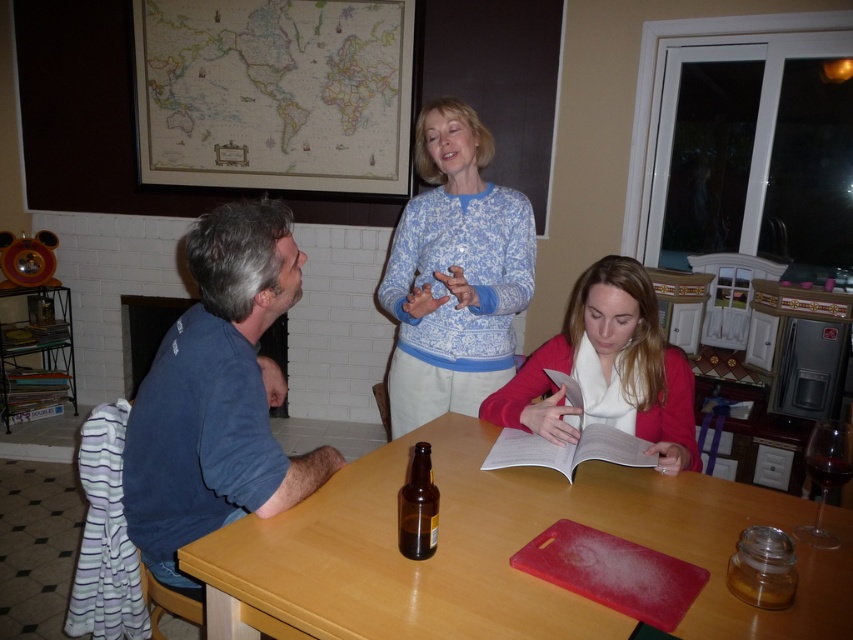
Question: Which point is farther to the camera?

Choices:
 (A) blue cotton shirt at left
 (B) blue patterned sweater at center
 (C) brown glass bottle at center

Answer: (B)

Question: Does vintage paper map at upper center lie behind blue patterned sweater at center?

Choices:
 (A) no
 (B) yes

Answer: (B)

Question: Considering the real-world distances, which object is farthest from the blue patterned sweater at center?

Choices:
 (A) blue cotton shirt at left
 (B) matte pink sweater at lower center
 (C) vintage paper map at upper center

Answer: (C)

Question: Can you confirm if blue cotton shirt at left is smaller than matte pink sweater at lower center?

Choices:
 (A) yes
 (B) no

Answer: (B)

Question: Which object is farther from the camera taking this photo?

Choices:
 (A) wooden table at center
 (B) matte pink sweater at lower center
 (C) blue patterned sweater at center
 (D) blue cotton shirt at left

Answer: (C)

Question: Is wooden table at center above blue patterned sweater at center?

Choices:
 (A) yes
 (B) no

Answer: (B)